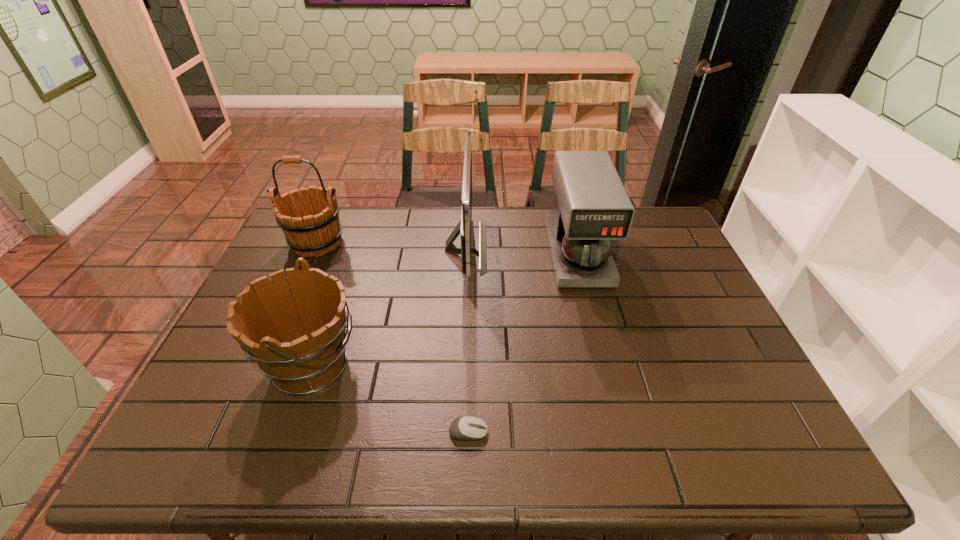
Where is `the taller wine bucket`? Image resolution: width=960 pixels, height=540 pixels. the taller wine bucket is located at coordinates (318, 231).

Where is `monitor`? The image size is (960, 540). monitor is located at coordinates (465, 245).

This screenshot has height=540, width=960. I want to click on the rightmost object, so click(x=591, y=207).

Locate an element on the screen. The width and height of the screenshot is (960, 540). the second nearest object is located at coordinates (296, 333).

You are a GUI agent. You are given a task and a screenshot of the screen. Output one action in this format:
    pyautogui.click(x=<x>, y=<y>)
    Task: Click on the nearer wine bucket
    This screenshot has width=960, height=540.
    Given the screenshot: What is the action you would take?
    pyautogui.click(x=296, y=333)

What are the coordinates of `the shortest object` in the screenshot? It's located at (468, 428).

Identify the location of computer equipment. (468, 428).

In order to click on blank space located 0.350m on the front of the farther wine bucket in this screenshot , I will do `click(270, 348)`.

I want to click on vacant region located on the screen side of the monitor, so click(565, 247).

Find the location of a particular element. This screenshot has height=540, width=960. free space located on the carafe side of the rightmost object is located at coordinates (617, 407).